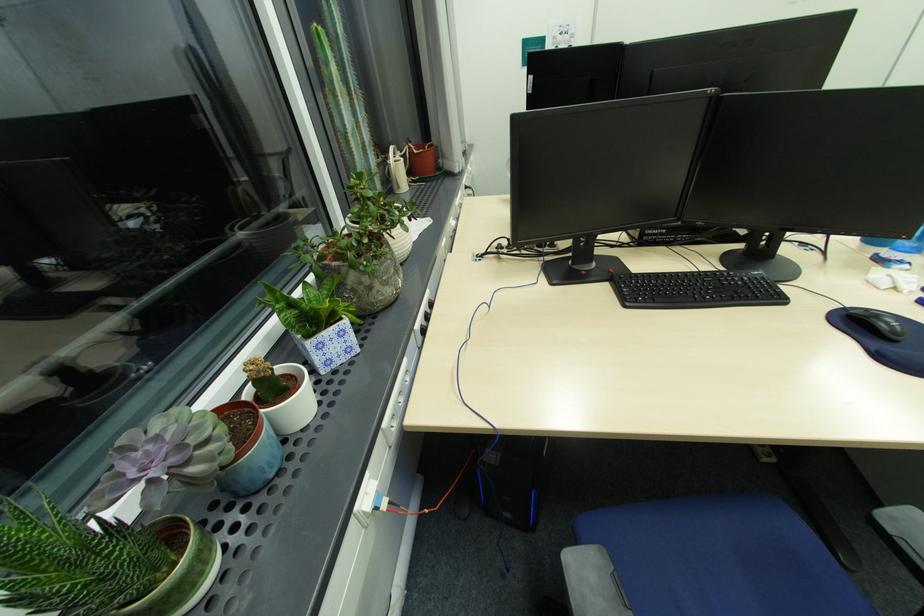
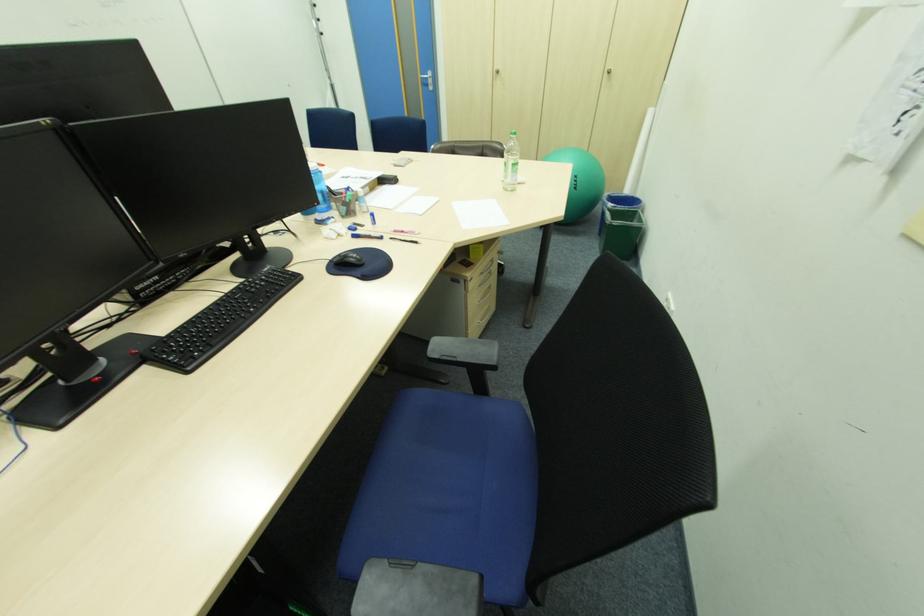
Based on the continuous images, in which direction is the camera rotating?

The rotation direction of the camera is right-down.